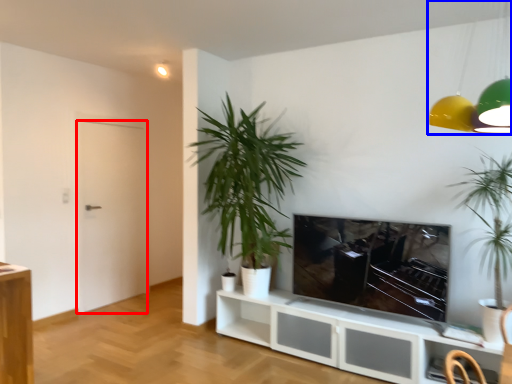
Question: Among these objects, which one is farthest to the camera, door (highlighted by a red box) or lamp (highlighted by a blue box)?

Choices:
 (A) door
 (B) lamp

Answer: (A)